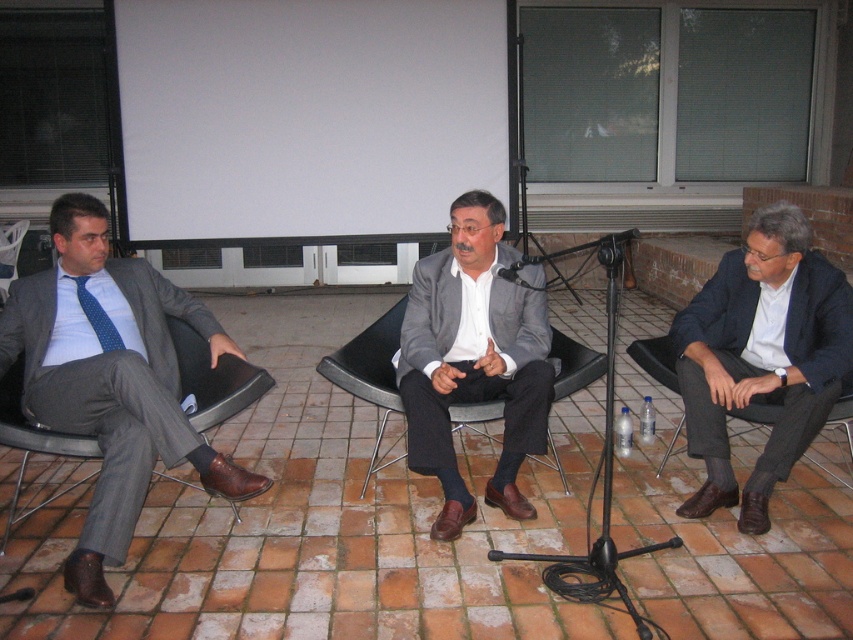
Does matte gray suit at left have a greater width compared to dark blue suit at center?

Yes, matte gray suit at left is wider than dark blue suit at center.

Between point (79, 372) and point (778, 346), which one is positioned in front?

Positioned in front is point (79, 372).

The image size is (853, 640). I want to click on matte gray suit at left, so click(111, 381).

Measure the distance between point (96, 376) and camera.

A distance of 8.42 feet exists between point (96, 376) and camera.

Does matte gray suit at left have a smaller size compared to black leather chair at left?

No.

Find the location of `matte gray suit at left`. matte gray suit at left is located at coordinates (111, 381).

Does matte gray suit at left have a greater height compared to black matte microphone at center?

Correct, matte gray suit at left is much taller as black matte microphone at center.

Who is positioned more to the left, matte gray suit at left or black matte microphone at center?

Positioned to the left is matte gray suit at left.

The height and width of the screenshot is (640, 853). What do you see at coordinates (111, 381) in the screenshot?
I see `matte gray suit at left` at bounding box center [111, 381].

Find the location of a particular element. This screenshot has width=853, height=640. matte gray suit at left is located at coordinates (111, 381).